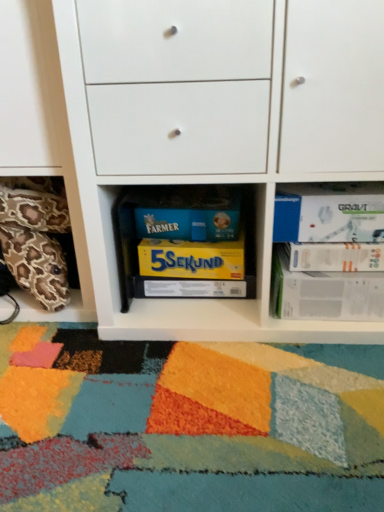
Find the location of a particular element. The height and width of the screenshot is (512, 384). empty space that is ontop of white matte paperback book at upper right, marked as the fifth paperback book in a bottom-to-top arrangement (from a real-world perspective) is located at coordinates (342, 216).